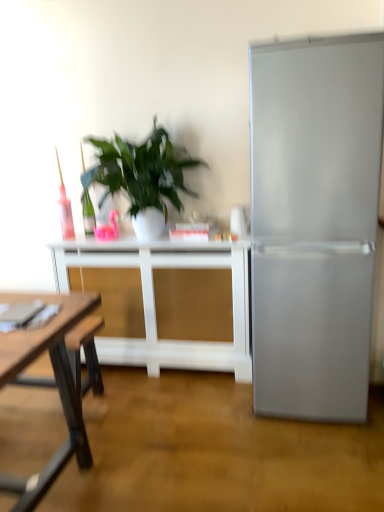
Question: Considering the relative sizes of satin silver refrigerator at right and white matte table at center in the image provided, is satin silver refrigerator at right taller than white matte table at center?

Choices:
 (A) no
 (B) yes

Answer: (B)

Question: From a real-world perspective, is satin silver refrigerator at right under white matte table at center?

Choices:
 (A) no
 (B) yes

Answer: (A)

Question: Is satin silver refrigerator at right positioned in front of white matte table at center?

Choices:
 (A) no
 (B) yes

Answer: (B)

Question: Can you confirm if satin silver refrigerator at right is thinner than white matte table at center?

Choices:
 (A) yes
 (B) no

Answer: (B)

Question: From a real-world perspective, is satin silver refrigerator at right on top of white matte table at center?

Choices:
 (A) yes
 (B) no

Answer: (A)

Question: Considering the positions of green leafy plant at center and satin silver refrigerator at right in the image, is green leafy plant at center bigger or smaller than satin silver refrigerator at right?

Choices:
 (A) big
 (B) small

Answer: (B)

Question: From the image's perspective, is green leafy plant at center positioned above or below satin silver refrigerator at right?

Choices:
 (A) above
 (B) below

Answer: (A)

Question: Visually, is green leafy plant at center positioned to the left or to the right of satin silver refrigerator at right?

Choices:
 (A) right
 (B) left

Answer: (B)

Question: In terms of width, does green leafy plant at center look wider or thinner when compared to satin silver refrigerator at right?

Choices:
 (A) wide
 (B) thin

Answer: (B)

Question: From a real-world perspective, is satin silver refrigerator at right above or below green leafy plant at center?

Choices:
 (A) above
 (B) below

Answer: (B)

Question: Considering their positions, is satin silver refrigerator at right located in front of or behind green leafy plant at center?

Choices:
 (A) behind
 (B) front

Answer: (B)

Question: Is satin silver refrigerator at right situated inside green leafy plant at center or outside?

Choices:
 (A) outside
 (B) inside

Answer: (A)

Question: From the image's perspective, relative to green leafy plant at center, is satin silver refrigerator at right above or below?

Choices:
 (A) above
 (B) below

Answer: (B)

Question: Is satin silver refrigerator at right in front of or behind white matte table at center in the image?

Choices:
 (A) front
 (B) behind

Answer: (A)

Question: From a real-world perspective, is satin silver refrigerator at right positioned above or below white matte table at center?

Choices:
 (A) above
 (B) below

Answer: (A)